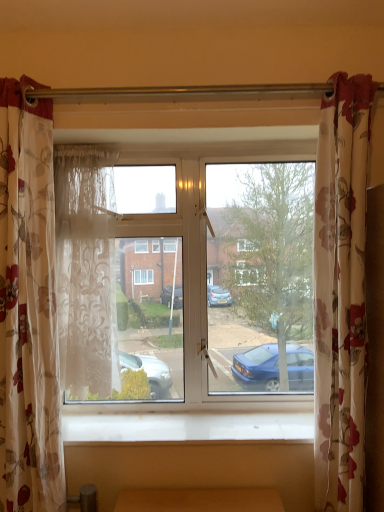
Question: Is white wood at lower center in front of or behind clear glass window at center in the image?

Choices:
 (A) front
 (B) behind

Answer: (A)

Question: Is point (69, 442) closer or farther from the camera than point (249, 381)?

Choices:
 (A) closer
 (B) farther

Answer: (A)

Question: Estimate the real-world distances between objects in this image. Which object is closer to the floral fabric curtain at right, which is the 1th curtain from right to left?

Choices:
 (A) clear glass window at center
 (B) white wood at lower center
 (C) floral fabric curtain at left, which is the 1th curtain in left-to-right order
 (D) sheer floral fabric curtain at left, which ranks as the 2th curtain in right-to-left order

Answer: (A)

Question: Which object is positioned farthest from the floral fabric curtain at left, the 3th curtain when ordered from right to left?

Choices:
 (A) clear glass window at center
 (B) floral fabric curtain at right, which is the 1th curtain from right to left
 (C) white wood at lower center
 (D) sheer floral fabric curtain at left, which ranks as the 2th curtain in left-to-right order

Answer: (B)